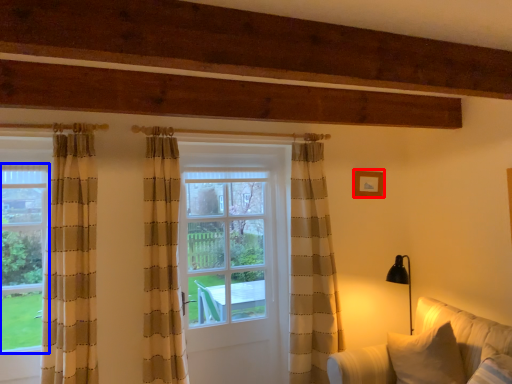
Question: Which of the following is the farthest to the observer, picture frame (highlighted by a red box) or bay window (highlighted by a blue box)?

Choices:
 (A) picture frame
 (B) bay window

Answer: (A)